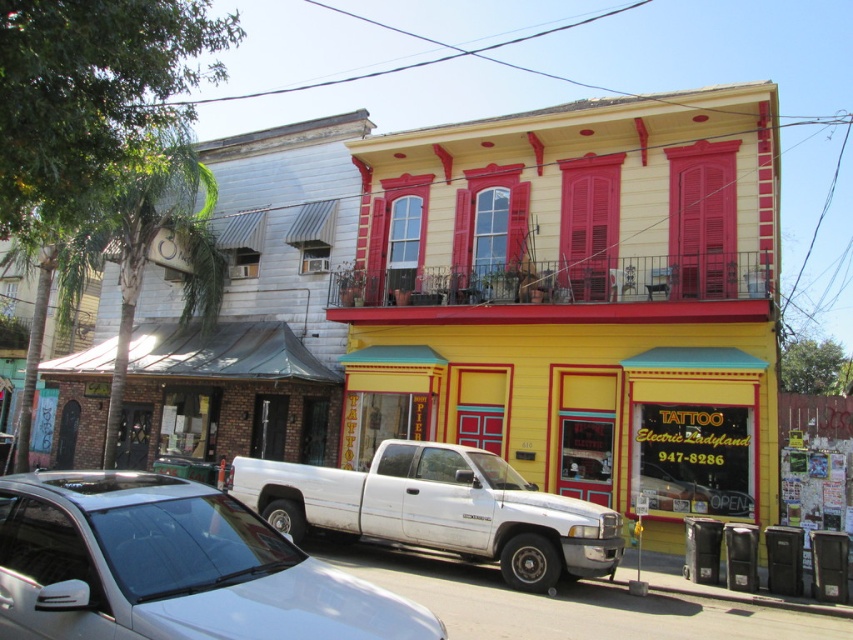
Question: Considering the relative positions of white matte truck at center and matte wood shutter at upper right in the image provided, where is white matte truck at center located with respect to matte wood shutter at upper right?

Choices:
 (A) left
 (B) right

Answer: (A)

Question: Can you confirm if yellow matte building at center is positioned below white matte truck at center?

Choices:
 (A) yes
 (B) no

Answer: (B)

Question: Which object is the closest to the red matte shutter at upper center?

Choices:
 (A) white matte truck at center
 (B) yellow matte building at center

Answer: (B)

Question: Can you confirm if white matte truck at center is thinner than matte wood shutter at upper right?

Choices:
 (A) no
 (B) yes

Answer: (A)

Question: Among these objects, which one is nearest to the camera?

Choices:
 (A) matte wood shutter at upper right
 (B) white matte truck at center
 (C) yellow matte building at center
 (D) red matte shutter at upper center

Answer: (B)

Question: Which object is farther from the camera taking this photo?

Choices:
 (A) red matte shutter at upper center
 (B) yellow matte building at center
 (C) matte wood shutter at upper right
 (D) white matte truck at center

Answer: (A)